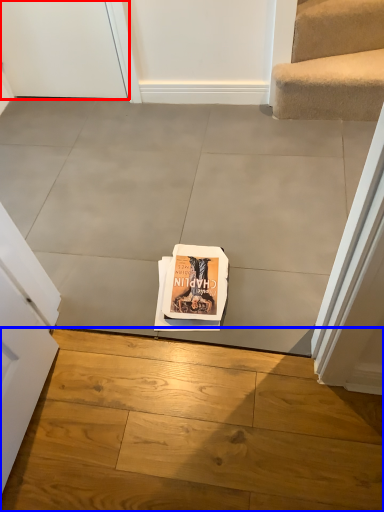
Question: Which point is further to the camera, door (highlighted by a red box) or concrete (highlighted by a blue box)?

Choices:
 (A) door
 (B) concrete

Answer: (A)